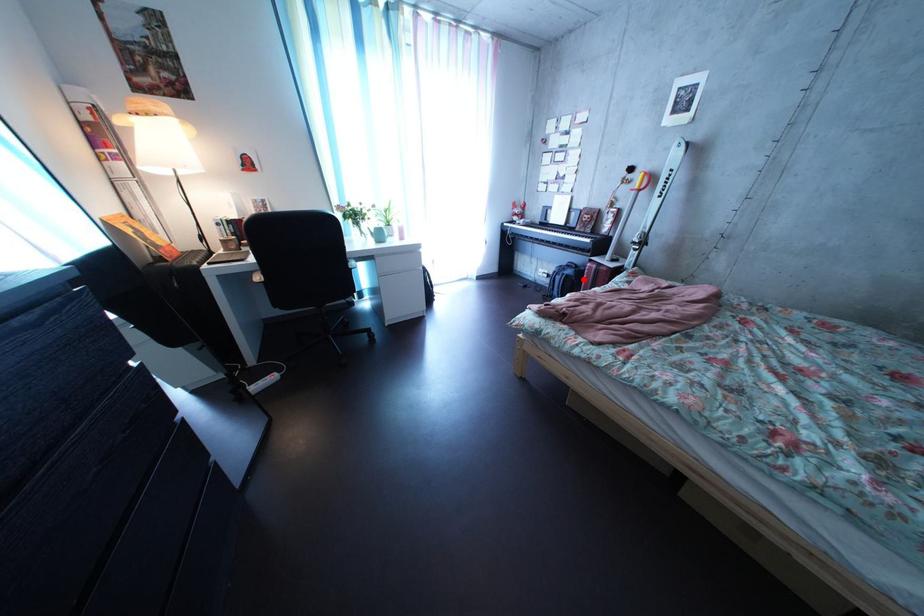
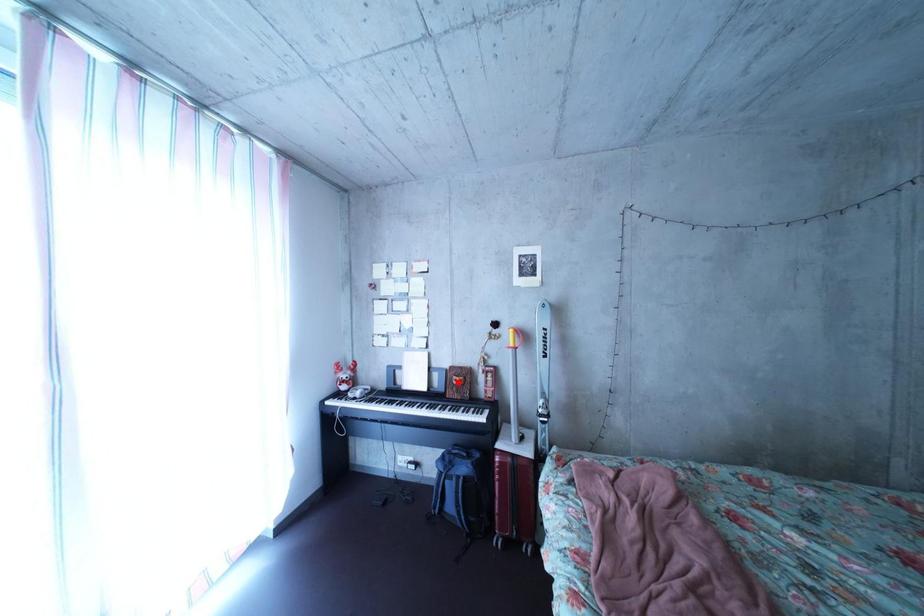
I am providing you with two images of the same scene from different viewpoints. A red point is marked on the first image and another point is marked on the second image. Does the point marked in image1 correspond to the same location as the one in image2?

No